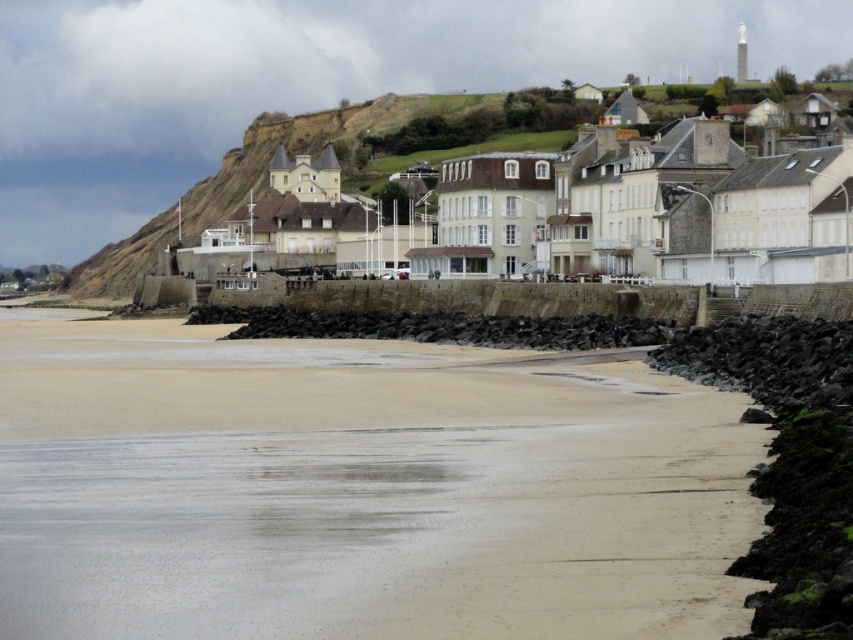
Which is above, sandy beach at lower center or white stone buildings at center?

white stone buildings at center is higher up.

Who is positioned more to the right, sandy beach at lower center or white stone buildings at center?

white stone buildings at center is more to the right.

Does point (700, 484) lie in front of point (670, 212)?

That is True.

Where is `sandy beach at lower center`? This screenshot has width=853, height=640. sandy beach at lower center is located at coordinates (358, 490).